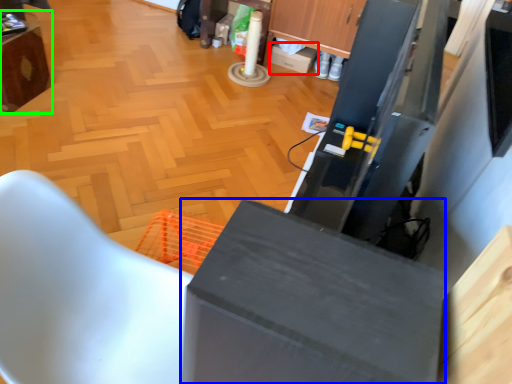
Question: Which object is the closest to the box (highlighted by a red box)? Choose among these: cabinetry (highlighted by a blue box) or furniture (highlighted by a green box).

Choices:
 (A) cabinetry
 (B) furniture

Answer: (B)